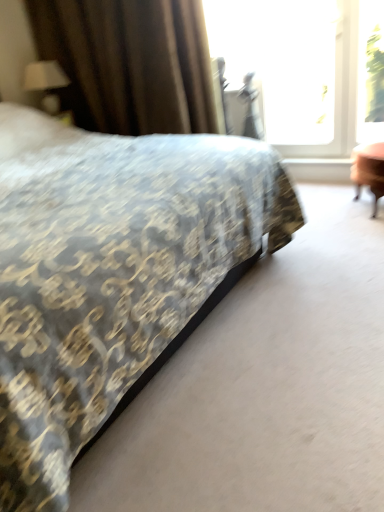
Question: From the image's perspective, does transparent glass window screen at upper right appear lower than patterned fabric bed at center?

Choices:
 (A) yes
 (B) no

Answer: (B)

Question: Is transparent glass window screen at upper right taller than patterned fabric bed at center?

Choices:
 (A) yes
 (B) no

Answer: (B)

Question: Considering the relative sizes of transparent glass window screen at upper right and patterned fabric bed at center in the image provided, is transparent glass window screen at upper right shorter than patterned fabric bed at center?

Choices:
 (A) yes
 (B) no

Answer: (A)

Question: Can you confirm if transparent glass window screen at upper right is bigger than patterned fabric bed at center?

Choices:
 (A) no
 (B) yes

Answer: (A)

Question: Can we say transparent glass window screen at upper right lies outside patterned fabric bed at center?

Choices:
 (A) yes
 (B) no

Answer: (A)

Question: Is patterned fabric bed at center situated inside transparent glass window screen at upper right or outside?

Choices:
 (A) outside
 (B) inside

Answer: (A)

Question: From the image's perspective, is patterned fabric bed at center above or below transparent glass window screen at upper right?

Choices:
 (A) above
 (B) below

Answer: (B)

Question: Considering the positions of point (139, 147) and point (365, 53), is point (139, 147) closer or farther from the camera than point (365, 53)?

Choices:
 (A) closer
 (B) farther

Answer: (A)

Question: Visually, is patterned fabric bed at center positioned to the left or to the right of transparent glass window screen at upper right?

Choices:
 (A) right
 (B) left

Answer: (B)

Question: Considering the positions of point (357, 104) and point (289, 35), is point (357, 104) closer or farther from the camera than point (289, 35)?

Choices:
 (A) closer
 (B) farther

Answer: (A)

Question: From a real-world perspective, relative to transparent glass window at upper right, is transparent glass window screen at upper right vertically above or below?

Choices:
 (A) above
 (B) below

Answer: (B)

Question: In terms of width, does transparent glass window screen at upper right look wider or thinner when compared to transparent glass window at upper right?

Choices:
 (A) thin
 (B) wide

Answer: (B)

Question: Which is correct: transparent glass window screen at upper right is inside transparent glass window at upper right, or outside of it?

Choices:
 (A) outside
 (B) inside

Answer: (A)

Question: In the image, is matte white lampshade at upper left positioned in front of or behind brown textured curtain at upper left?

Choices:
 (A) behind
 (B) front

Answer: (A)

Question: From a real-world perspective, is matte white lampshade at upper left physically located above or below brown textured curtain at upper left?

Choices:
 (A) below
 (B) above

Answer: (A)